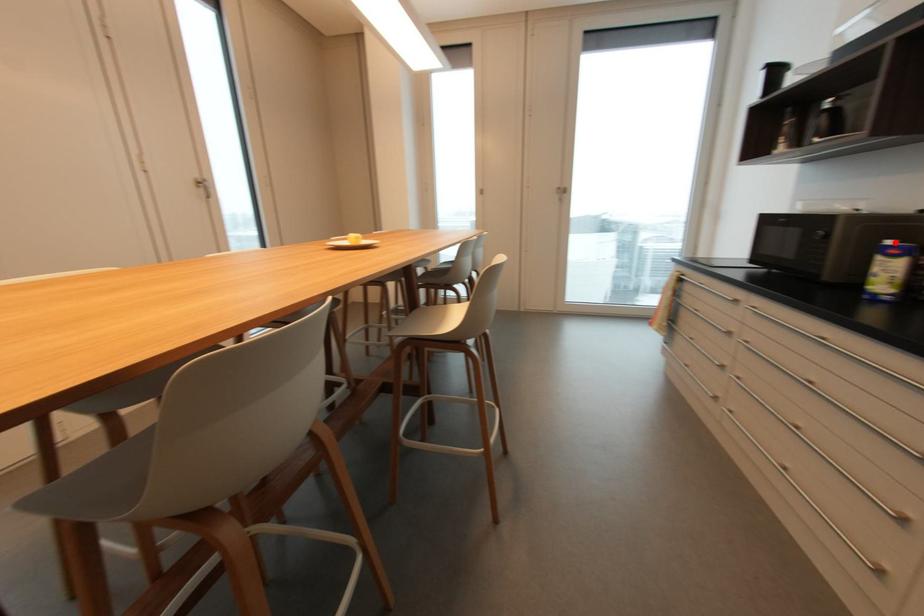
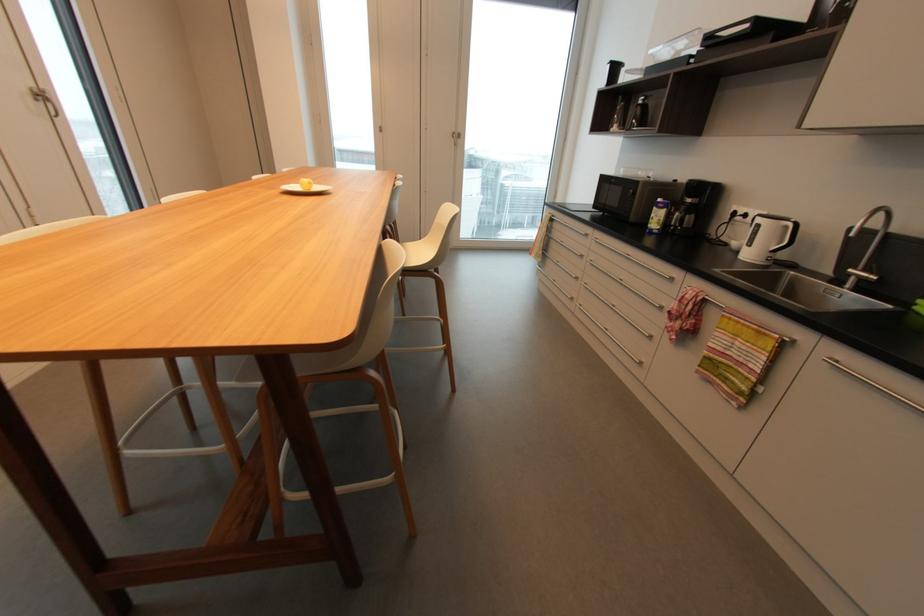
Find the pixel in the second image that matches the highlighted location in the first image.

(663, 200)